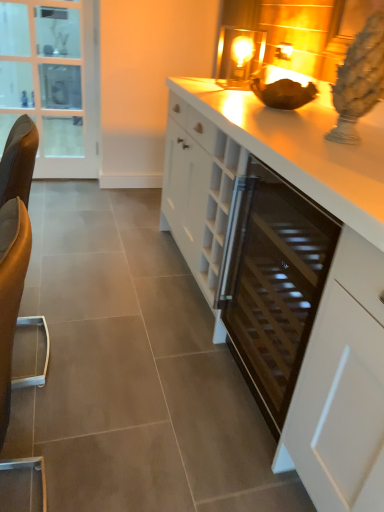
Question: Can you confirm if white glossy countertop at center is smaller than clear glass door at left?

Choices:
 (A) no
 (B) yes

Answer: (A)

Question: Is the depth of white glossy countertop at center greater than that of clear glass door at left?

Choices:
 (A) yes
 (B) no

Answer: (B)

Question: Does white glossy countertop at center contain clear glass door at left?

Choices:
 (A) no
 (B) yes

Answer: (A)

Question: Is white glossy countertop at center beside clear glass door at left?

Choices:
 (A) no
 (B) yes

Answer: (A)

Question: Is white glossy countertop at center at the right side of clear glass door at left?

Choices:
 (A) no
 (B) yes

Answer: (B)

Question: From a real-world perspective, is white glossy countertop at center physically below clear glass door at left?

Choices:
 (A) yes
 (B) no

Answer: (A)

Question: Does white glossy countertop at center have a larger size compared to black glass wine cooler at center?

Choices:
 (A) yes
 (B) no

Answer: (A)

Question: Considering the relative positions of white glossy countertop at center and black glass wine cooler at center in the image provided, is white glossy countertop at center behind black glass wine cooler at center?

Choices:
 (A) yes
 (B) no

Answer: (A)

Question: Can you confirm if white glossy countertop at center is shorter than black glass wine cooler at center?

Choices:
 (A) yes
 (B) no

Answer: (B)

Question: Is white glossy countertop at center wider than black glass wine cooler at center?

Choices:
 (A) yes
 (B) no

Answer: (A)

Question: Is white glossy countertop at center smaller than black glass wine cooler at center?

Choices:
 (A) yes
 (B) no

Answer: (B)

Question: Is the position of white glossy countertop at center less distant than that of black glass wine cooler at center?

Choices:
 (A) no
 (B) yes

Answer: (A)

Question: From the image's perspective, is white matte cabinet at center over black glass wine cooler at center?

Choices:
 (A) yes
 (B) no

Answer: (B)